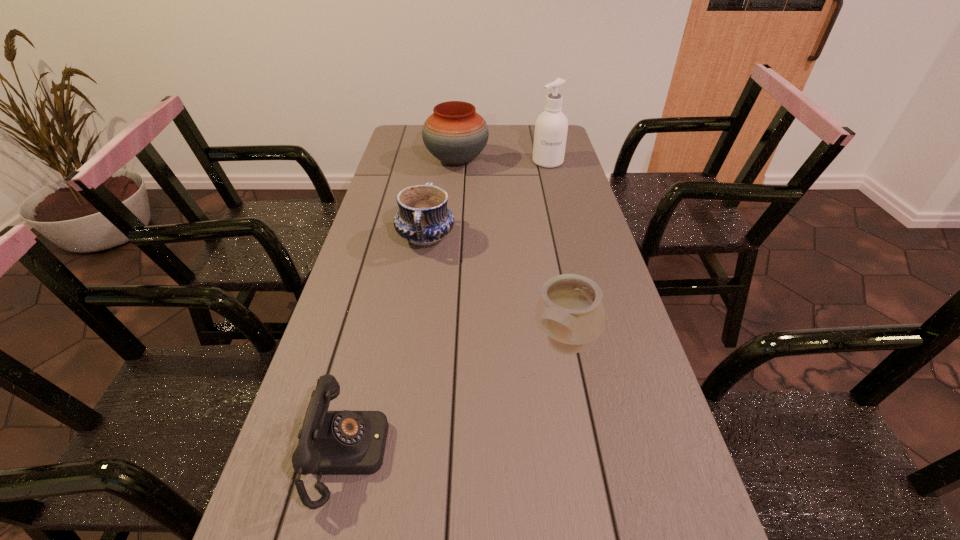
Identify the location of free space between the farthest pottery and the tallest object. This screenshot has width=960, height=540. (502, 161).

This screenshot has height=540, width=960. I want to click on object that is the third closest one to the shortest object, so (455, 134).

I want to click on object that stands as the second closest to the cleansing agent, so (423, 219).

The width and height of the screenshot is (960, 540). What are the coordinates of `pottery that is the second closest to the third farthest object` in the screenshot? It's located at (570, 311).

Identify which pottery is the second closest to the farthest pottery. Please provide its 2D coordinates. Your answer should be formatted as a tuple, i.e. [(x, y)], where the tuple contains the x and y coordinates of a point satisfying the conditions above.

[(570, 311)]

Locate an element on the screen. The image size is (960, 540). free point that satisfies the following two spatial constraints: 1. on the front label of the tallest object; 2. on the dial of the nearest object is located at coordinates (621, 454).

Find the location of `vacant space that satisfies the following two spatial constraints: 1. on the front label of the cleansing agent; 2. on the dial of the nearest object`. vacant space that satisfies the following two spatial constraints: 1. on the front label of the cleansing agent; 2. on the dial of the nearest object is located at coordinates (621, 454).